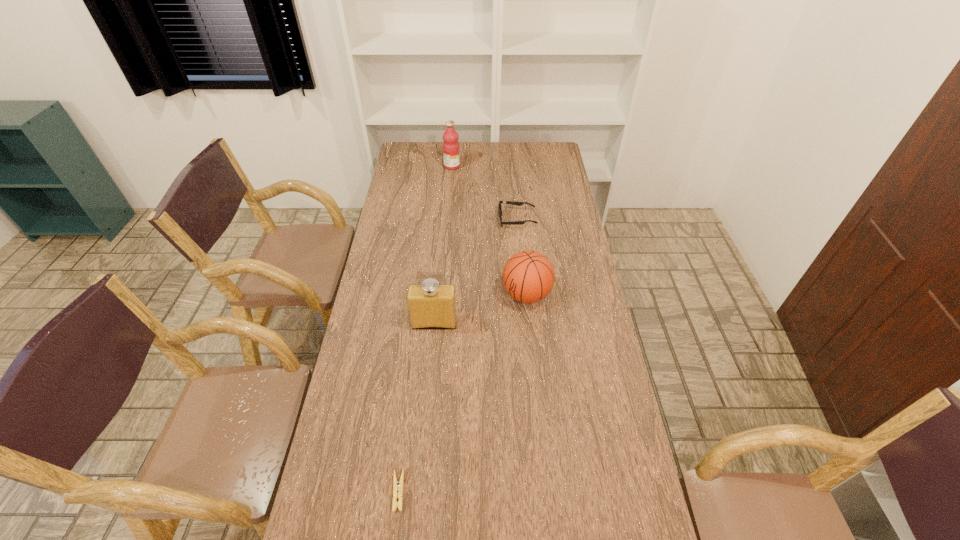
At what (x,y) coordinates should I click in order to perform the action: click on the farthest object. Please return your answer as a coordinate pair (x, y). Looking at the image, I should click on (451, 153).

At what (x,y) coordinates should I click in order to perform the action: click on perfume. Please return your answer as a coordinate pair (x, y). This screenshot has width=960, height=540. Looking at the image, I should click on (431, 305).

Find the location of a particular element. The image size is (960, 540). the third nearest object is located at coordinates (528, 276).

You are a GUI agent. You are given a task and a screenshot of the screen. Output one action in this format:
    pyautogui.click(x=<x>, y=<y>)
    Task: Click on the basketball
    The height and width of the screenshot is (540, 960).
    Given the screenshot: What is the action you would take?
    pyautogui.click(x=528, y=276)

At what (x,y) coordinates should I click in order to perform the action: click on the second shortest object. Please return your answer as a coordinate pair (x, y). This screenshot has height=540, width=960. Looking at the image, I should click on (506, 202).

The width and height of the screenshot is (960, 540). Identify the location of the fourth nearest object. (506, 202).

Image resolution: width=960 pixels, height=540 pixels. In order to click on the shortest object in this screenshot , I will do `click(396, 487)`.

The image size is (960, 540). I want to click on the nearest object, so click(396, 487).

I want to click on vacant space located on the label of the farthest object, so click(478, 166).

Locate an element on the screen. free location located on the front-facing side of the perfume is located at coordinates (423, 440).